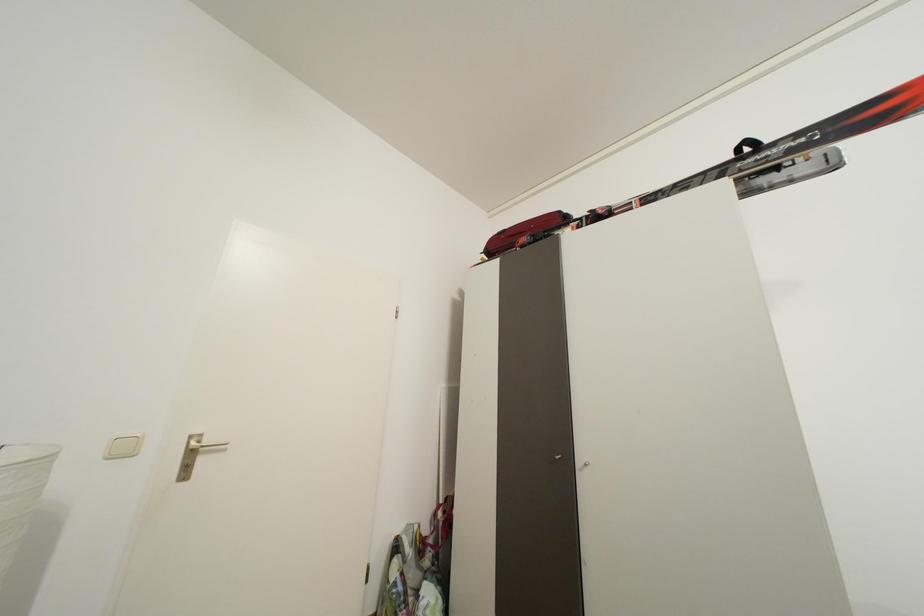
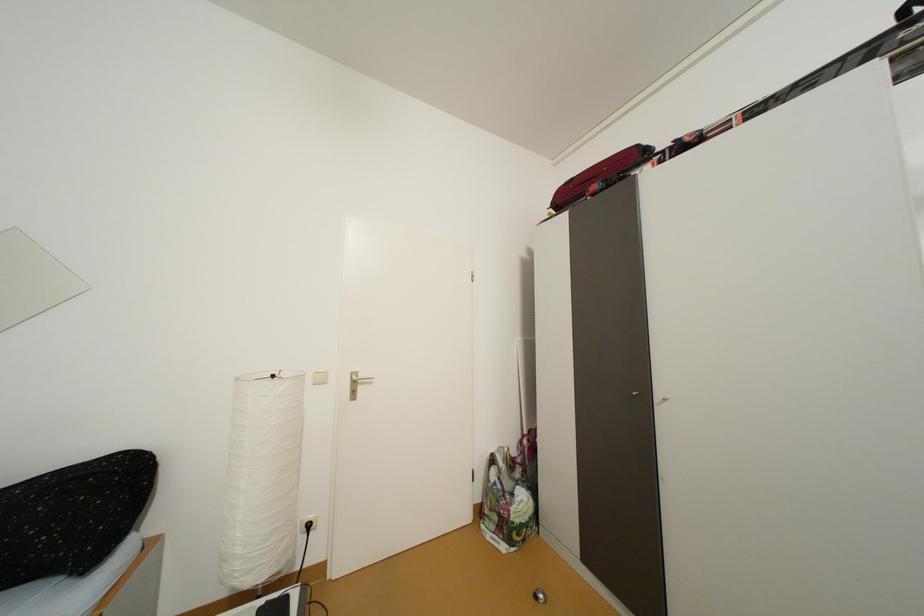
Question: What movement of the cameraman would produce the second image?

Choices:
 (A) Left
 (B) Right
 (C) Forward
 (D) Backward

Answer: (D)